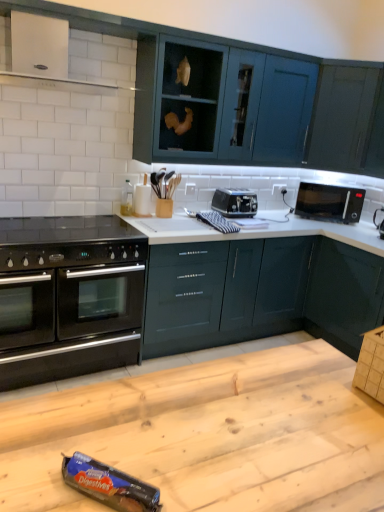
The image size is (384, 512). What are the coordinates of `vacant area located to the right-hand side of blue cardboard digestives at lower center, marked as the 1th appliance in a front-to-back arrangement` in the screenshot? It's located at (193, 477).